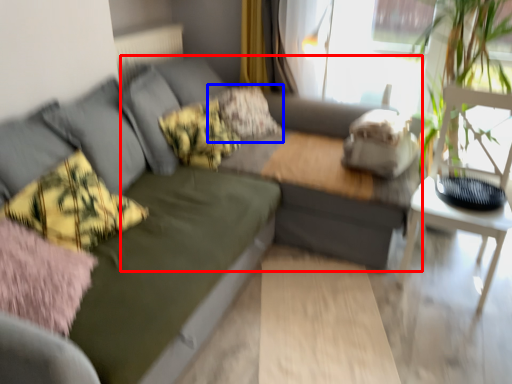
Question: Which object is further to the camera taking this photo, couch (highlighted by a red box) or pillow (highlighted by a blue box)?

Choices:
 (A) couch
 (B) pillow

Answer: (B)